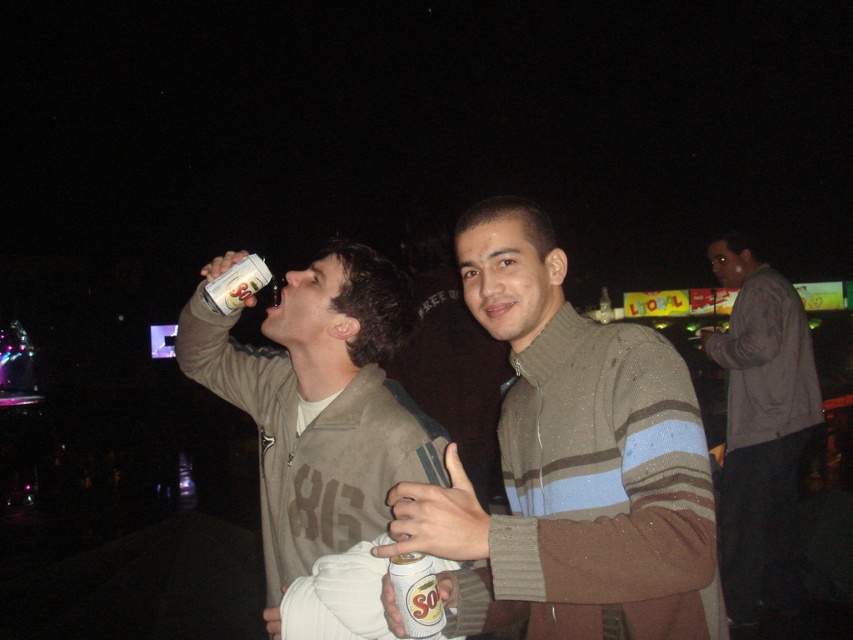
You are at a party and see the matte gray jacket at center and the white matte can at center. Which object is closer to you?

The matte gray jacket at center is closer to you because the white matte can at center is behind it.

From the picture: Based on the scene description, which can is positioned to the right of the other? Mention both the white matte can at center and metallic silver can at upper left in your question.

The white matte can at center is to the right of the metallic silver can at upper left.

You are a photographer trying to capture a clear photo of the matte gray jacket at center and the white matte can at center. Since the jacket is larger, which object should you focus on first to ensure both are in frame?

The matte gray jacket at center is larger in size than the white matte can at center, so you should focus on the matte gray jacket at center first to ensure it fits within the frame before adjusting for the smaller can.